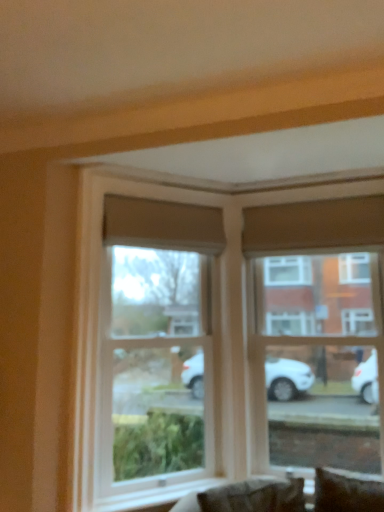
The height and width of the screenshot is (512, 384). What do you see at coordinates (318, 333) in the screenshot? I see `clear glass window at upper right, the first window viewed from the right` at bounding box center [318, 333].

The width and height of the screenshot is (384, 512). I want to click on clear glass window at upper right, the first window viewed from the right, so click(x=318, y=333).

Based on the photo, considering the relative positions of clear glass window at center, marked as the second window in a right-to-left arrangement, and clear glass window at upper right, the 2th window in the left-to-right sequence, in the image provided, is clear glass window at center, marked as the second window in a right-to-left arrangement, to the right of clear glass window at upper right, the 2th window in the left-to-right sequence, from the viewer's perspective?

Incorrect, clear glass window at center, marked as the second window in a right-to-left arrangement, is not on the right side of clear glass window at upper right, the 2th window in the left-to-right sequence.

Could you tell me if clear glass window at center, marked as the second window in a right-to-left arrangement, is facing clear glass window at upper right, the first window viewed from the right?

No, clear glass window at center, marked as the second window in a right-to-left arrangement, is not oriented towards clear glass window at upper right, the first window viewed from the right.

Is clear glass window at center, marked as the second window in a right-to-left arrangement, in contact with clear glass window at upper right, the 2th window in the left-to-right sequence?

No, clear glass window at center, marked as the second window in a right-to-left arrangement, is not beside clear glass window at upper right, the 2th window in the left-to-right sequence.

Looking at this image, which of these two, clear glass window at center, marked as the second window in a right-to-left arrangement, or clear glass window at upper right, the first window viewed from the right, stands taller?

Standing taller between the two is clear glass window at upper right, the first window viewed from the right.

Starting from the dark brown leather couch at lower center, which window is the 2nd one behind? Please provide its 2D coordinates.

[(318, 333)]

From a real-world perspective, does dark brown leather couch at lower center stand above clear glass window at upper right, the 2th window in the left-to-right sequence?

No, from a real-world perspective, dark brown leather couch at lower center is not on top of clear glass window at upper right, the 2th window in the left-to-right sequence.

Considering the sizes of objects dark brown leather couch at lower center and clear glass window at upper right, the first window viewed from the right, in the image provided, who is taller, dark brown leather couch at lower center or clear glass window at upper right, the first window viewed from the right,?

With more height is clear glass window at upper right, the first window viewed from the right.

Considering the relative positions of dark brown leather couch at lower center and clear glass window at upper right, the first window viewed from the right, in the image provided, is dark brown leather couch at lower center to the left of clear glass window at upper right, the first window viewed from the right, from the viewer's perspective?

Yes.

Image resolution: width=384 pixels, height=512 pixels. I want to click on couch on the right of clear glass window at center, marked as the second window in a right-to-left arrangement, so click(x=245, y=496).

Is clear glass window at center, marked as the second window in a right-to-left arrangement, taller than dark brown leather couch at lower center?

Yes, clear glass window at center, marked as the second window in a right-to-left arrangement, is taller than dark brown leather couch at lower center.

Is clear glass window at center, the 1th window in the left-to-right sequence, facing away from dark brown leather couch at lower center?

clear glass window at center, the 1th window in the left-to-right sequence, is not turned away from dark brown leather couch at lower center.

Who is smaller, clear glass window at center, the 1th window in the left-to-right sequence, or dark brown leather couch at lower center?

Smaller between the two is dark brown leather couch at lower center.

Looking at this image, from the image's perspective, which object appears higher, clear glass window at upper right, the 2th window in the left-to-right sequence, or clear glass window at center, the 1th window in the left-to-right sequence?

From the image's view, clear glass window at center, the 1th window in the left-to-right sequence, is above.

Between clear glass window at upper right, the 2th window in the left-to-right sequence, and clear glass window at center, marked as the second window in a right-to-left arrangement, which one has smaller width?

With smaller width is clear glass window at upper right, the 2th window in the left-to-right sequence.

Would you say clear glass window at upper right, the 2th window in the left-to-right sequence, is outside clear glass window at center, marked as the second window in a right-to-left arrangement?

Yes.

From the image's perspective, is dark brown leather couch at lower center above clear glass window at center, the 1th window in the left-to-right sequence?

Actually, dark brown leather couch at lower center appears below clear glass window at center, the 1th window in the left-to-right sequence, in the image.

Between dark brown leather couch at lower center and clear glass window at center, the 1th window in the left-to-right sequence, which one has larger size?

Bigger between the two is clear glass window at center, the 1th window in the left-to-right sequence.

Can clear glass window at center, the 1th window in the left-to-right sequence, be found inside dark brown leather couch at lower center?

No, dark brown leather couch at lower center does not contain clear glass window at center, the 1th window in the left-to-right sequence.

How many degrees apart are the facing directions of dark brown leather couch at lower center and clear glass window at center, marked as the second window in a right-to-left arrangement?

The angle between the facing direction of dark brown leather couch at lower center and the facing direction of clear glass window at center, marked as the second window in a right-to-left arrangement, is 35.4 degrees.

What's the angular difference between clear glass window at upper right, the first window viewed from the right, and dark brown leather couch at lower center's facing directions?

→ The angular difference between clear glass window at upper right, the first window viewed from the right, and dark brown leather couch at lower center is 12.5 degrees.

At what (x,y) coordinates should I click in order to perform the action: click on the 2nd window located above the dark brown leather couch at lower center (from a real-world perspective). Please return your answer as a coordinate pair (x, y). The height and width of the screenshot is (512, 384). Looking at the image, I should click on (318, 333).

Who is taller, clear glass window at upper right, the 2th window in the left-to-right sequence, or dark brown leather couch at lower center?

clear glass window at upper right, the 2th window in the left-to-right sequence.

From the image's perspective, would you say clear glass window at upper right, the 2th window in the left-to-right sequence, is positioned over dark brown leather couch at lower center?

Yes.

Where is `window below the clear glass window at upper right, the first window viewed from the right (from a real-world perspective)`? window below the clear glass window at upper right, the first window viewed from the right (from a real-world perspective) is located at coordinates (148, 357).

At what (x,y) coordinates should I click in order to perform the action: click on window that is the 1st one when counting upward from the dark brown leather couch at lower center (from the image's perspective). Please return your answer as a coordinate pair (x, y). Image resolution: width=384 pixels, height=512 pixels. Looking at the image, I should click on (318, 333).

Which object lies further to the anchor point clear glass window at upper right, the first window viewed from the right, dark brown leather couch at lower center or clear glass window at center, the 1th window in the left-to-right sequence?

Among the two, dark brown leather couch at lower center is located further to clear glass window at upper right, the first window viewed from the right.

Looking at this image, when comparing their distances from clear glass window at upper right, the 2th window in the left-to-right sequence, does clear glass window at center, the 1th window in the left-to-right sequence, or dark brown leather couch at lower center seem further?

dark brown leather couch at lower center is further to clear glass window at upper right, the 2th window in the left-to-right sequence.

Based on their spatial positions, is clear glass window at center, marked as the second window in a right-to-left arrangement, or clear glass window at upper right, the first window viewed from the right, closer to dark brown leather couch at lower center?

Among the two, clear glass window at center, marked as the second window in a right-to-left arrangement, is located nearer to dark brown leather couch at lower center.

Estimate the real-world distances between objects in this image. Which object is further from dark brown leather couch at lower center, clear glass window at upper right, the 2th window in the left-to-right sequence, or clear glass window at center, the 1th window in the left-to-right sequence?

The object further to dark brown leather couch at lower center is clear glass window at upper right, the 2th window in the left-to-right sequence.

Looking at the image, which one is located closer to clear glass window at center, marked as the second window in a right-to-left arrangement, dark brown leather couch at lower center or clear glass window at upper right, the 2th window in the left-to-right sequence?

Based on the image, clear glass window at upper right, the 2th window in the left-to-right sequence, appears to be nearer to clear glass window at center, marked as the second window in a right-to-left arrangement.

Looking at this image, based on their spatial positions, is clear glass window at upper right, the first window viewed from the right, or dark brown leather couch at lower center closer to clear glass window at center, marked as the second window in a right-to-left arrangement?

The object closer to clear glass window at center, marked as the second window in a right-to-left arrangement, is clear glass window at upper right, the first window viewed from the right.

Image resolution: width=384 pixels, height=512 pixels. In order to click on couch between clear glass window at center, the 1th window in the left-to-right sequence, and clear glass window at upper right, the 2th window in the left-to-right sequence in this screenshot , I will do `click(245, 496)`.